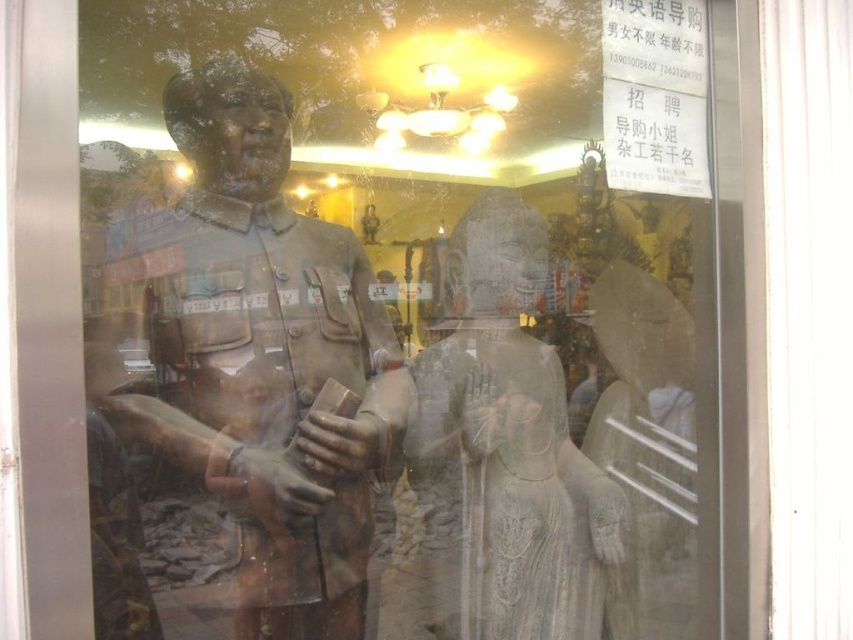
Question: Which point is closer to the camera?

Choices:
 (A) (141, 282)
 (B) (467, 259)

Answer: (A)

Question: Is rusty stone statue at center positioned behind white marble statue at right?

Choices:
 (A) no
 (B) yes

Answer: (A)

Question: Considering the real-world distances, which object is farthest from the bronze statue at left?

Choices:
 (A) rusty stone statue at center
 (B) white marble statue at right

Answer: (B)

Question: Is bronze statue at left wider than white marble statue at right?

Choices:
 (A) no
 (B) yes

Answer: (B)

Question: Estimate the real-world distances between objects in this image. Which object is closer to the rusty stone statue at center?

Choices:
 (A) white marble statue at right
 (B) bronze statue at left

Answer: (A)

Question: Is bronze statue at left to the left of white marble statue at right from the viewer's perspective?

Choices:
 (A) no
 (B) yes

Answer: (B)